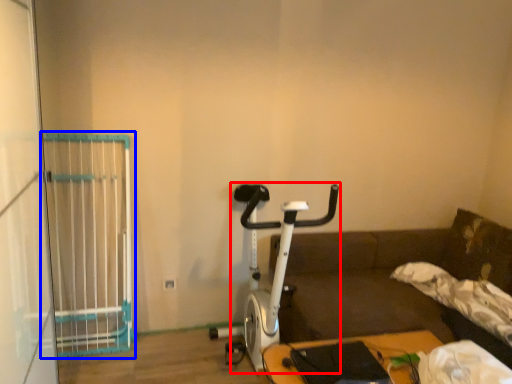
Question: Which of the following is the farthest to the observer, stationary bicycle (highlighted by a red box) or cage (highlighted by a blue box)?

Choices:
 (A) stationary bicycle
 (B) cage

Answer: (B)